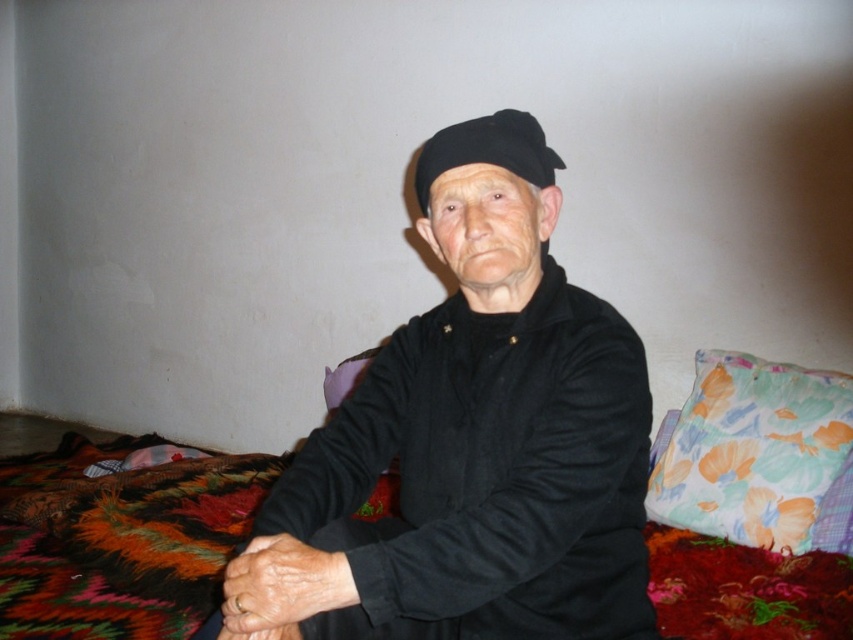
Question: Which point appears farthest from the camera in this image?

Choices:
 (A) (82, 625)
 (B) (376, 390)
 (C) (709, 532)
 (D) (479, 120)

Answer: (C)

Question: Is black matte jacket at center positioned behind floral fabric bed at center?

Choices:
 (A) no
 (B) yes

Answer: (A)

Question: Can you confirm if floral fabric bed at center is smaller than floral fabric pillow at lower right?

Choices:
 (A) yes
 (B) no

Answer: (B)

Question: Which of the following is the farthest from the observer?

Choices:
 (A) floral fabric bed at center
 (B) black fabric hat at center
 (C) floral fabric pillow at lower right
 (D) black matte jacket at center

Answer: (A)

Question: Considering the relative positions of black matte jacket at center and floral fabric pillow at lower right in the image provided, where is black matte jacket at center located with respect to floral fabric pillow at lower right?

Choices:
 (A) below
 (B) above

Answer: (B)

Question: Which object is closer to the camera taking this photo?

Choices:
 (A) floral fabric pillow at lower right
 (B) floral fabric bed at center
 (C) black fabric hat at center
 (D) black matte jacket at center

Answer: (D)